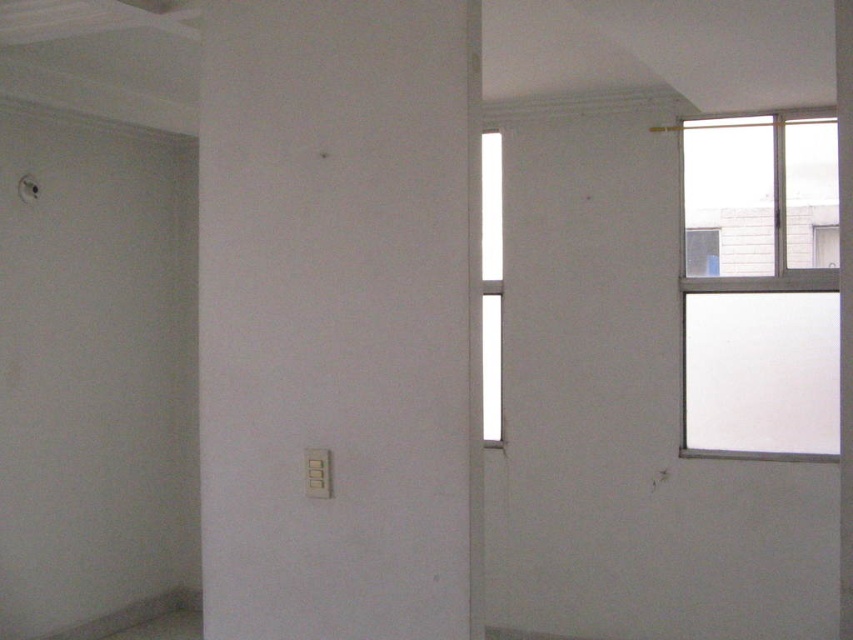
Question: Does transparent glass window at upper right have a greater width compared to white glass window at center?

Choices:
 (A) no
 (B) yes

Answer: (B)

Question: Does transparent glass window at upper right have a smaller size compared to white glass window at center?

Choices:
 (A) no
 (B) yes

Answer: (A)

Question: Which of the following is the closest to the observer?

Choices:
 (A) transparent glass window at upper right
 (B) white glass window at center

Answer: (A)

Question: Which of the following is the closest to the observer?

Choices:
 (A) (486, 412)
 (B) (712, 358)

Answer: (B)

Question: Does transparent glass window at upper right have a greater width compared to white glass window at center?

Choices:
 (A) yes
 (B) no

Answer: (A)